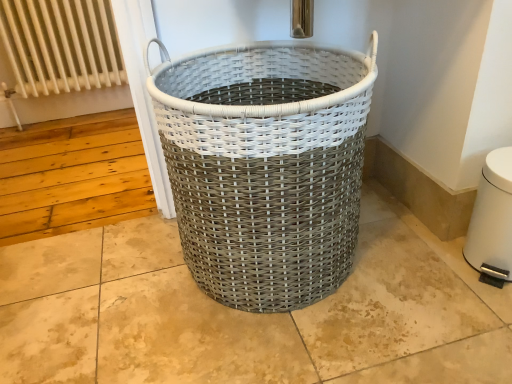
The height and width of the screenshot is (384, 512). I want to click on vacant region to the left of white plastic water heater at lower right, so click(x=426, y=275).